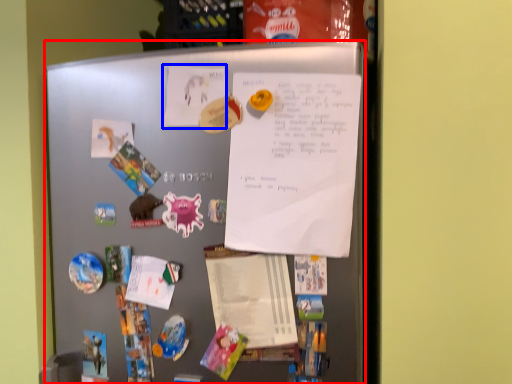
Question: Which object is further to the camera taking this photo, refrigerator (highlighted by a red box) or poster (highlighted by a blue box)?

Choices:
 (A) refrigerator
 (B) poster

Answer: (B)